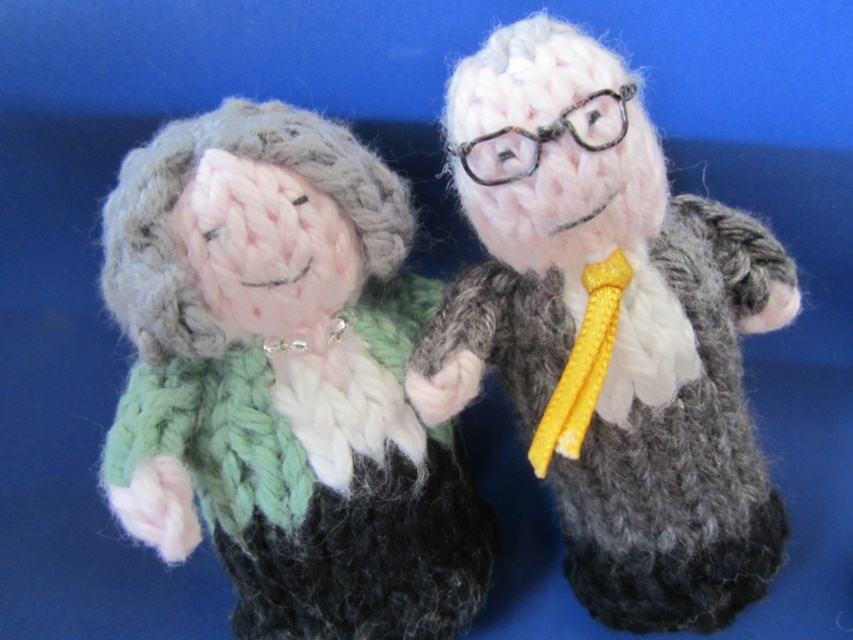
You are an interior designer arranging a display. You have the knitted woolen doll at center and the knitted woolen suit at center. Based on their positions, which object is more to the left?

The knitted woolen doll at center is positioned on the left side of knitted woolen suit at center, so it is more to the left.

You are a tailor trying to decide whether to place the knitted woolen doll at center onto the knitted woolen suit at center. Based on their sizes, can the doll fit inside the suit?

The knitted woolen doll at center is shorter than the knitted woolen suit at center, so the doll can fit inside the suit since it is smaller in height.